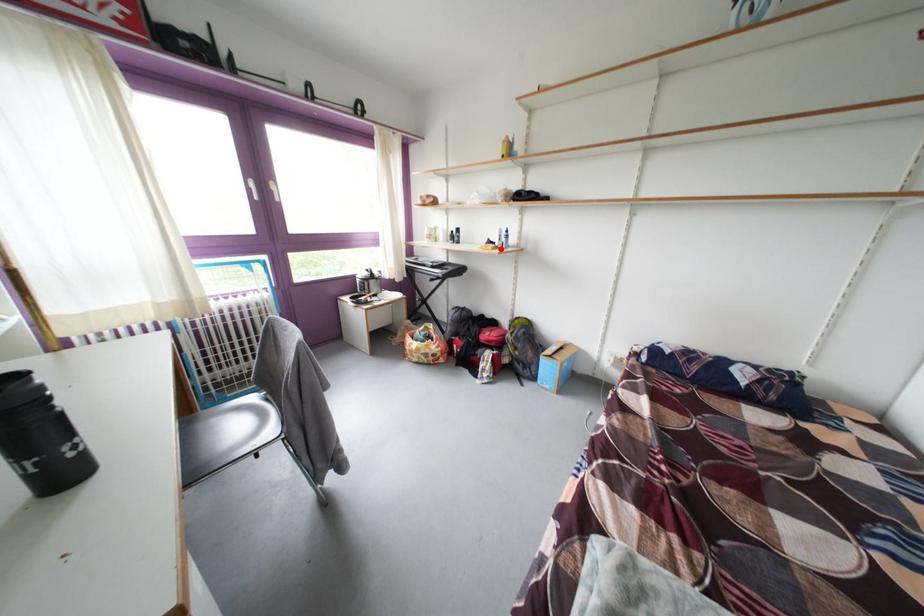
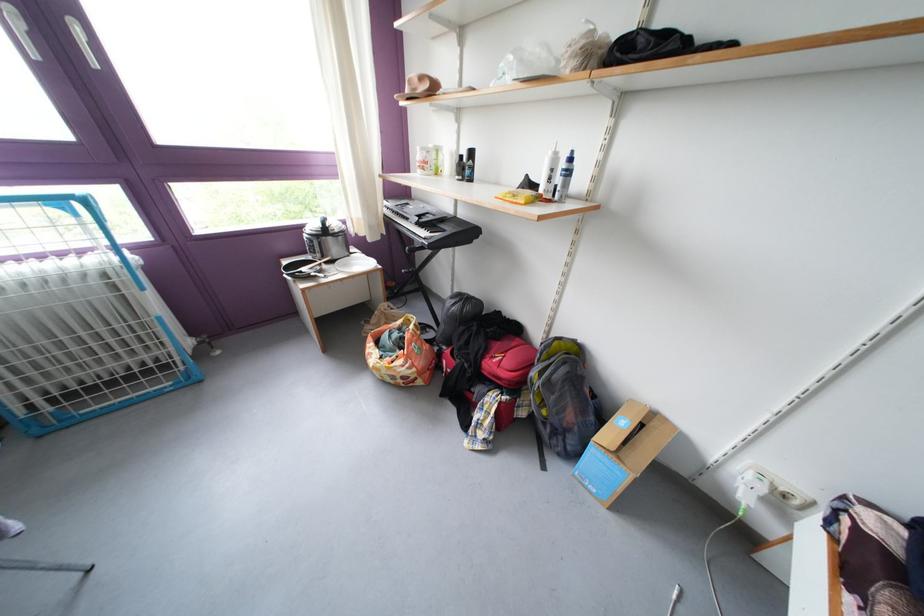
Locate, in the second image, the point that corresponds to the highlighted location in the first image.

(540, 191)